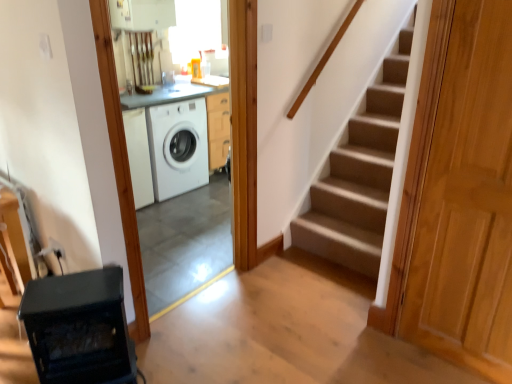
Locate an element on the screen. vacant space underneath white glossy washing machine at center (from a real-world perspective) is located at coordinates (193, 300).